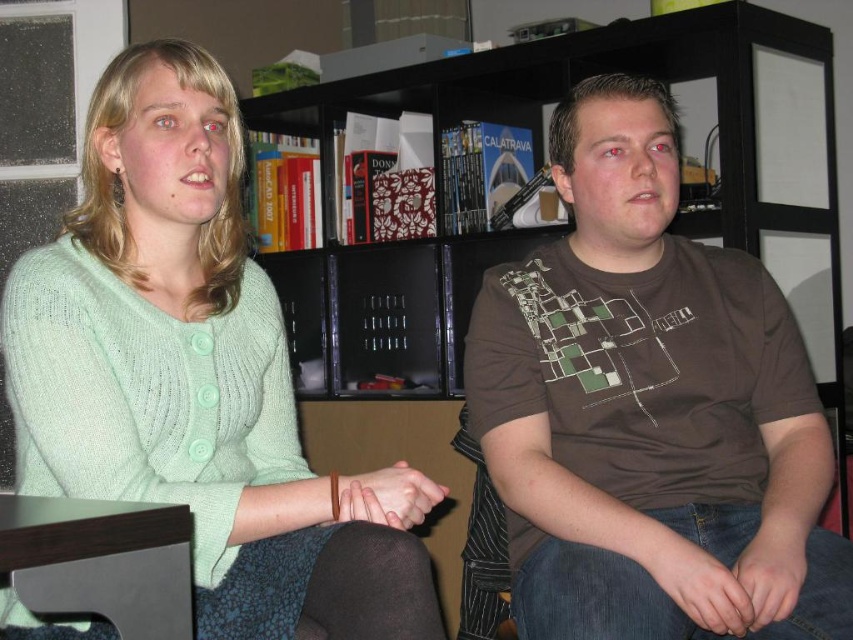
Question: Which object appears farthest from the camera in this image?

Choices:
 (A) black matte bookshelf at upper center
 (B) brown cotton t-shirt at center
 (C) jeans at lower right
 (D) green knitted sweater at upper left

Answer: (A)

Question: Which object is closer to the camera taking this photo?

Choices:
 (A) jeans at lower right
 (B) green knitted sweater at upper left

Answer: (B)

Question: Can you confirm if brown cotton t-shirt at center is thinner than black matte bookshelf at upper center?

Choices:
 (A) yes
 (B) no

Answer: (A)

Question: Which point is farther to the camera?

Choices:
 (A) black matte bookshelf at upper center
 (B) jeans at lower right
 (C) green knitted sweater at upper left
 (D) brown cotton t-shirt at center

Answer: (A)

Question: Can you confirm if green knitted sweater at upper left is positioned to the right of jeans at lower right?

Choices:
 (A) yes
 (B) no

Answer: (B)

Question: Is brown cotton t-shirt at center above jeans at lower right?

Choices:
 (A) no
 (B) yes

Answer: (B)